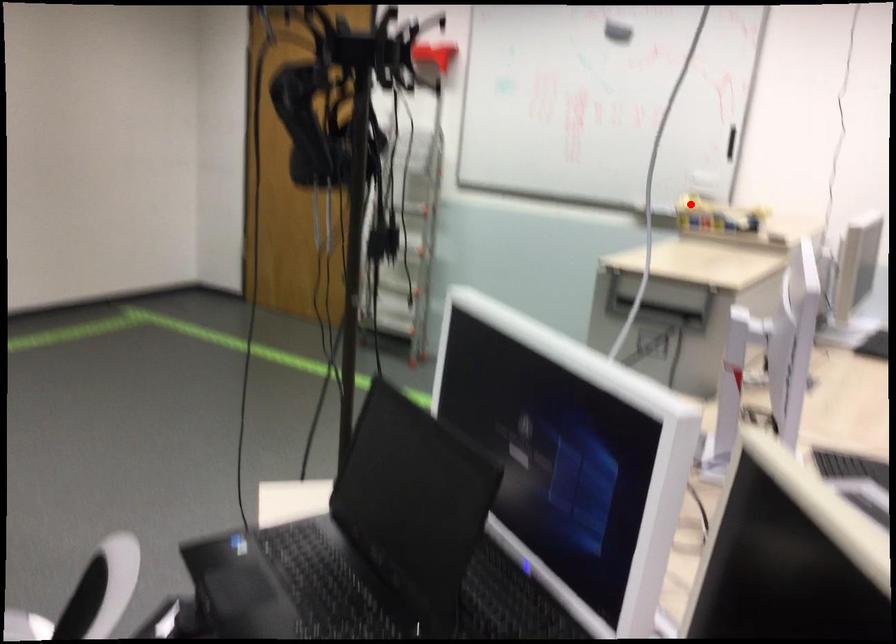
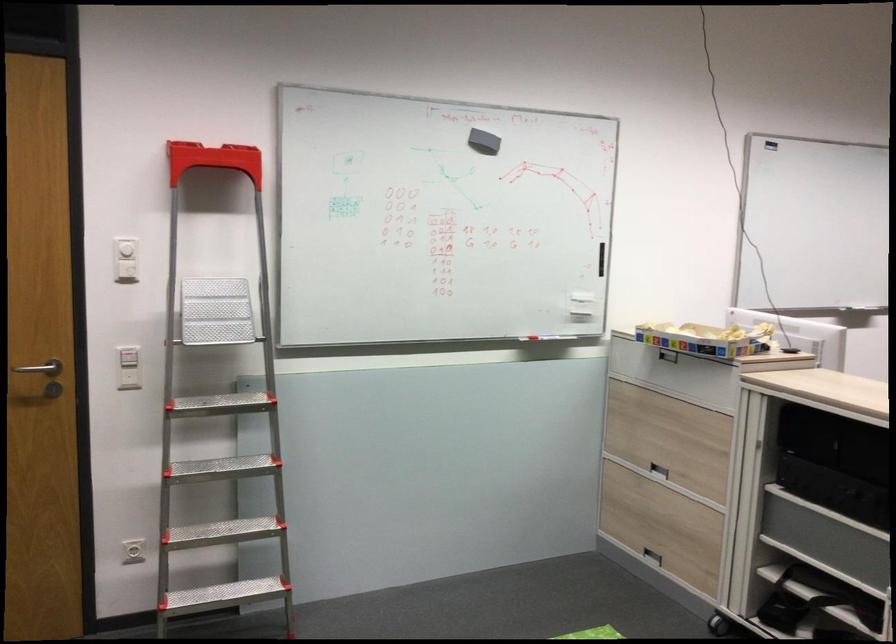
Find the pixel in the second image that matches the highlighted location in the first image.

(705, 339)